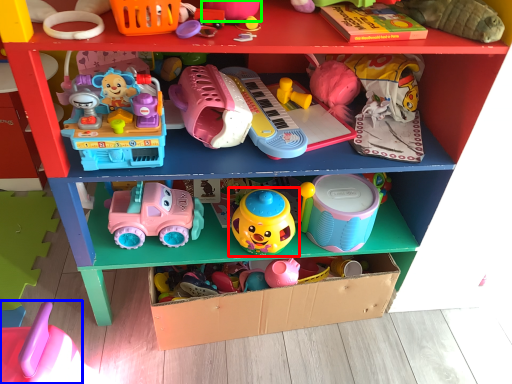
Question: Based on their relative distances, which object is nearer to toy (highlighted by a red box)? Choose from toy (highlighted by a blue box) and toy (highlighted by a green box).

Choices:
 (A) toy
 (B) toy

Answer: (B)